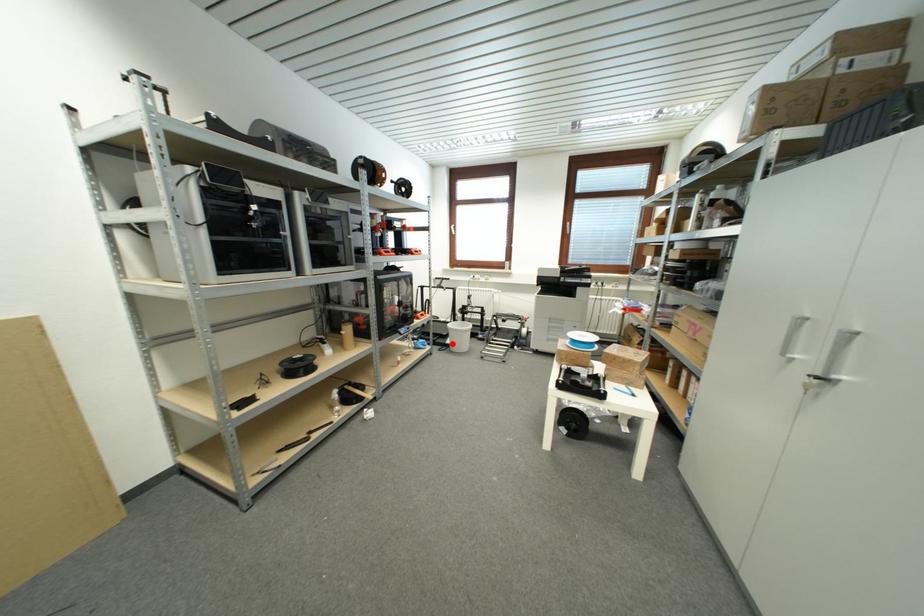
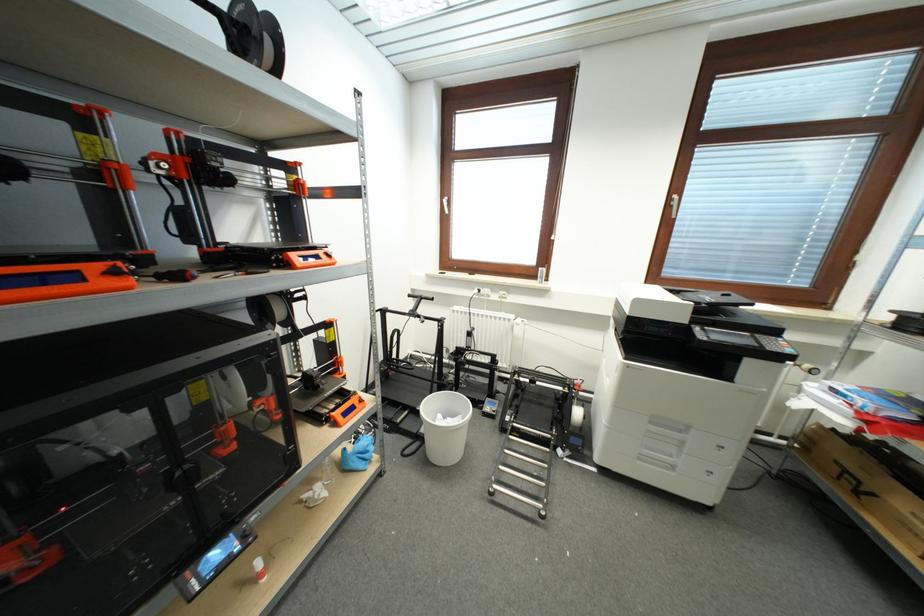
Find the pixel in the second image that matches the highlighted location in the first image.

(427, 434)